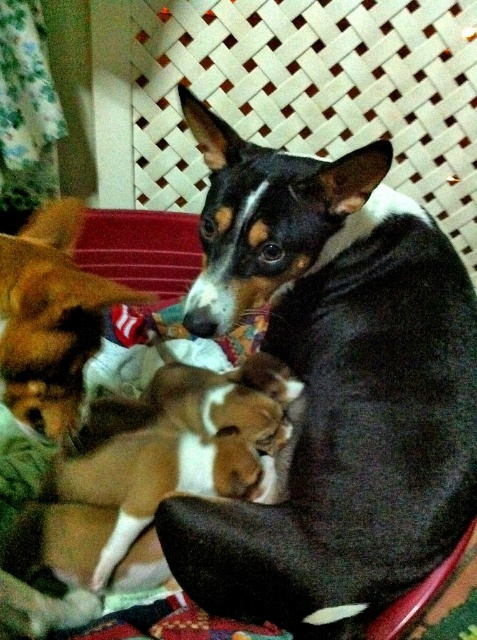
Does brown and white fur at center have a smaller size compared to brown soft fur at lower left?

No.

Between point (172, 413) and point (84, 360), which one is positioned behind?

The point (172, 413) is more distant.

Where is `brown and white fur at center`? Image resolution: width=477 pixels, height=640 pixels. brown and white fur at center is located at coordinates (140, 486).

Is black and white fur dog at center positioned before brown and white fur at center?

Yes.

Is point (200, 560) closer to viewer compared to point (177, 467)?

Yes, point (200, 560) is closer to viewer.

Image resolution: width=477 pixels, height=640 pixels. Identify the location of black and white fur dog at center. (332, 380).

Does black and white fur dog at center have a smaller size compared to brown soft fur at lower left?

No.

Can you confirm if black and white fur dog at center is shorter than brown soft fur at lower left?

No.

The height and width of the screenshot is (640, 477). Find the location of `black and white fur dog at center`. black and white fur dog at center is located at coordinates (332, 380).